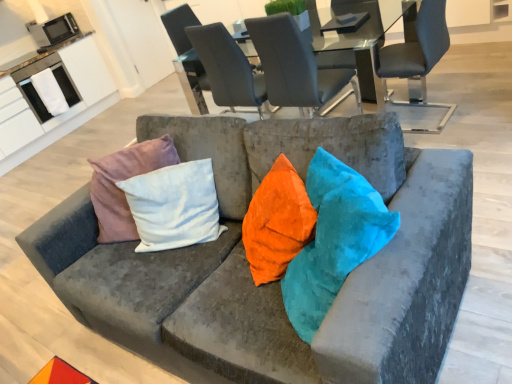
Question: Is white towel at upper left, the second appliance viewed from the top, wider or thinner than matte gray chair at upper center, which is the 4th chair from right to left?

Choices:
 (A) wide
 (B) thin

Answer: (A)

Question: Is point (23, 76) closer or farther from the camera than point (188, 8)?

Choices:
 (A) closer
 (B) farther

Answer: (B)

Question: Which is farther from the clear glass table at center?

Choices:
 (A) metallic microwave at upper left, the first appliance from the top
 (B) suede-like gray chair at upper center, placed as the third chair when sorted from left to right
 (C) white towel at upper left, the second appliance viewed from the top
 (D) velvet gray couch at center
 (E) matte gray chair at upper right, which is the 1th chair in right-to-left order

Answer: (A)

Question: Which object is positioned farthest from the velvet gray couch at center?

Choices:
 (A) velvet gray chair at center, which ranks as the 2th chair in left-to-right order
 (B) suede-like gray chair at upper center, placed as the third chair when sorted from left to right
 (C) matte gray chair at upper center, which is the 4th chair from right to left
 (D) metallic microwave at upper left, the first appliance from the top
 (E) clear glass table at center

Answer: (D)